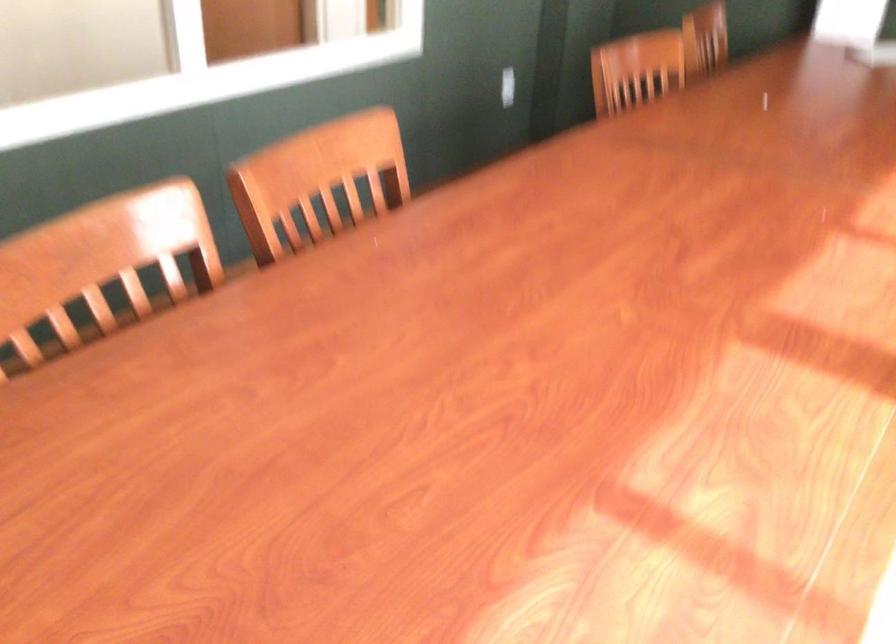
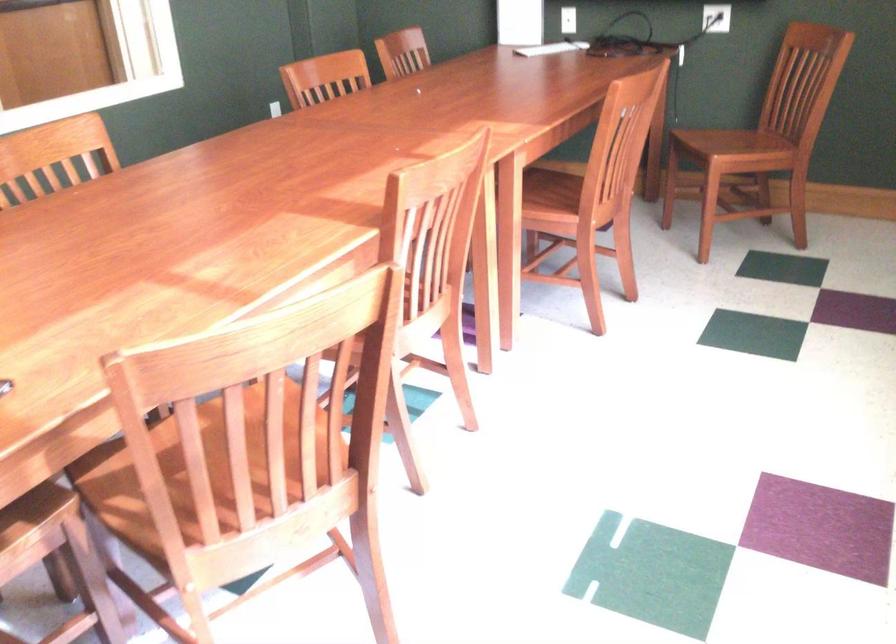
Question: Based on the continuous images, in which direction is the camera rotating? Reply with the corresponding letter.

Choices:
 (A) Left
 (B) Right
 (C) Up
 (D) Down

Answer: (B)